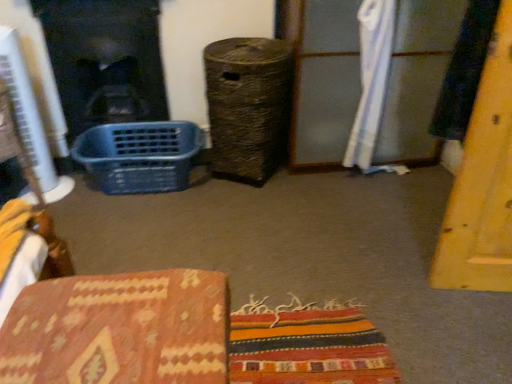
Question: In terms of height, does blue plastic basket at left look taller or shorter compared to black glass fireplace at left?

Choices:
 (A) short
 (B) tall

Answer: (A)

Question: Is blue plastic basket at left to the left or to the right of black glass fireplace at left in the image?

Choices:
 (A) left
 (B) right

Answer: (B)

Question: Which of these objects is positioned closest to the black glass fireplace at left?

Choices:
 (A) blue plastic basket at left
 (B) white fabric curtain at upper right

Answer: (A)

Question: Which object is the farthest from the black glass fireplace at left?

Choices:
 (A) white fabric curtain at upper right
 (B) blue plastic basket at left

Answer: (A)